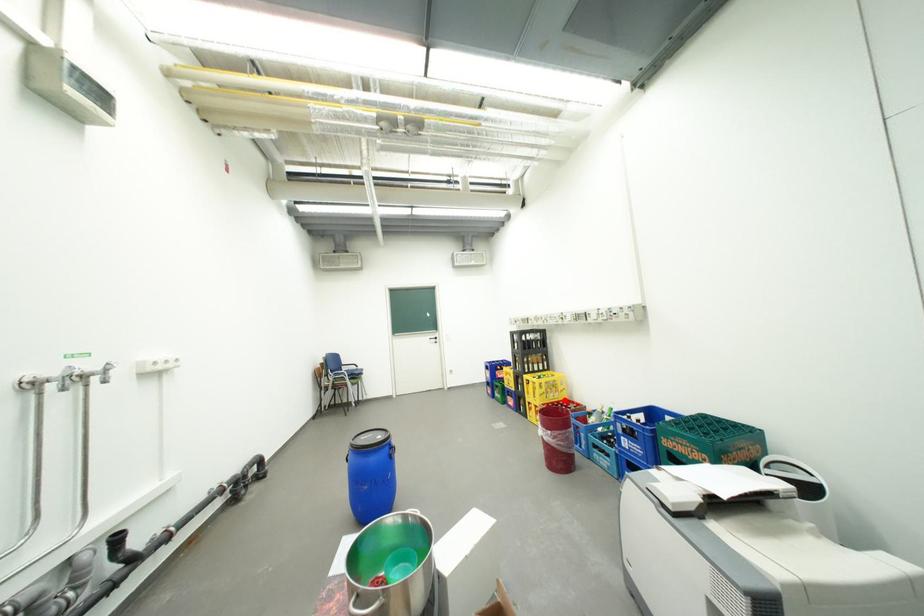
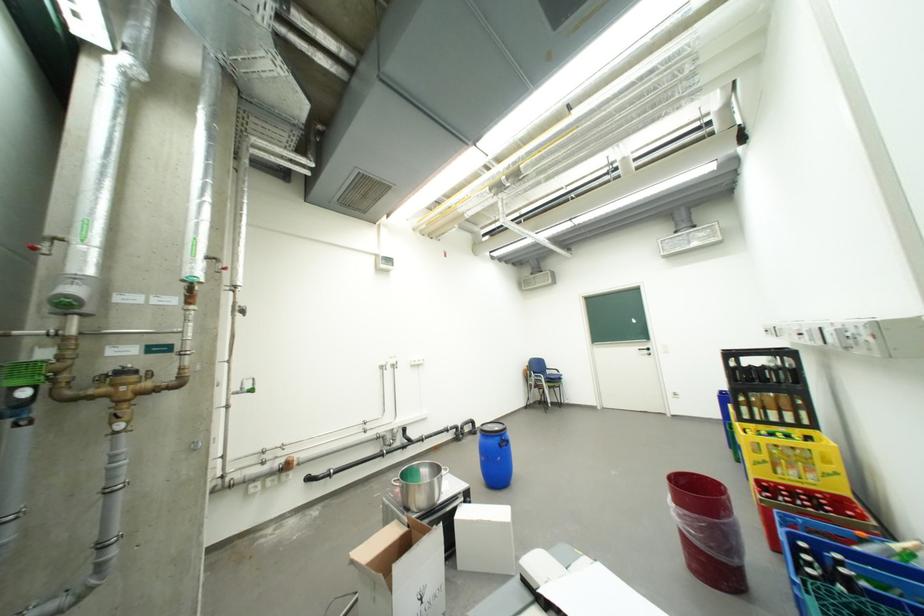
Locate, in the second image, the point that corresponds to the highlighted location in the first image.

(810, 484)